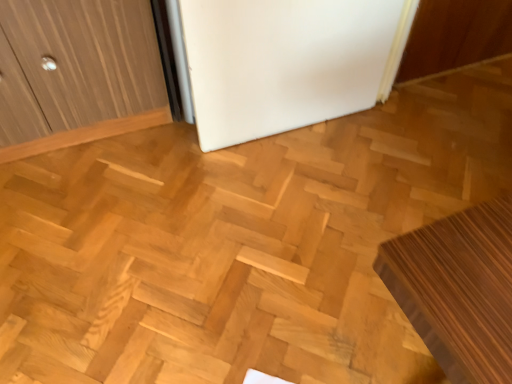
Where is `vacant area situated to the left side of white matte refrigerator at center`? Image resolution: width=512 pixels, height=384 pixels. vacant area situated to the left side of white matte refrigerator at center is located at coordinates (154, 170).